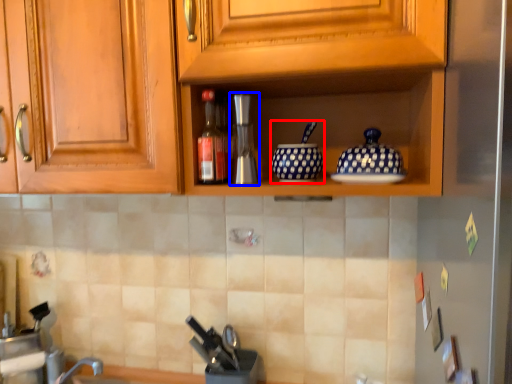
Question: Which of the following is the closest to the observer, tableware (highlighted by a red box) or coffee machine (highlighted by a blue box)?

Choices:
 (A) tableware
 (B) coffee machine

Answer: (A)